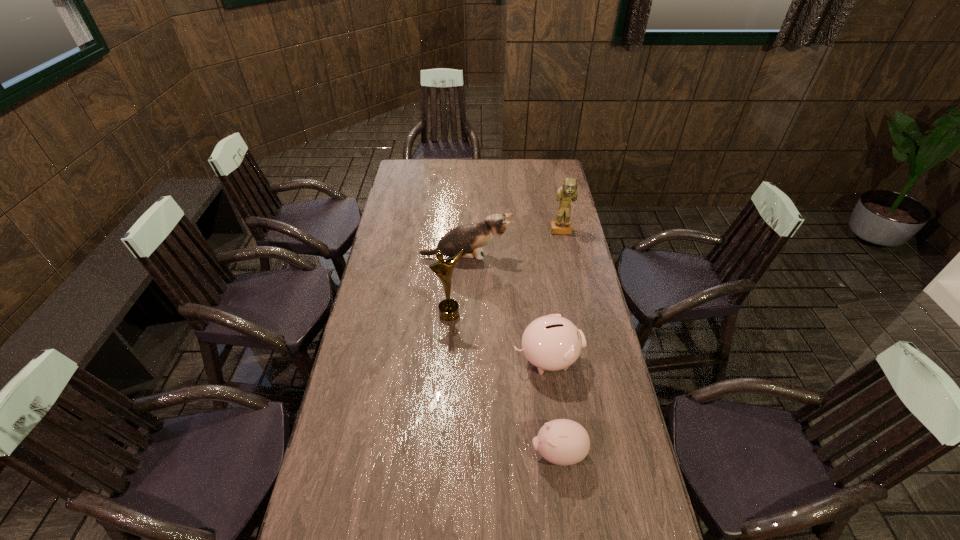
Where is `vacant space that satisfies the following two spatial constraints: 1. on the front-facing side of the figurine; 2. at the face of the cat`? Image resolution: width=960 pixels, height=540 pixels. vacant space that satisfies the following two spatial constraints: 1. on the front-facing side of the figurine; 2. at the face of the cat is located at coordinates (566, 256).

This screenshot has height=540, width=960. Find the location of `free point that satisfies the following two spatial constraints: 1. at the face of the third tallest object; 2. on the front-facing side of the third nearest object`. free point that satisfies the following two spatial constraints: 1. at the face of the third tallest object; 2. on the front-facing side of the third nearest object is located at coordinates (464, 314).